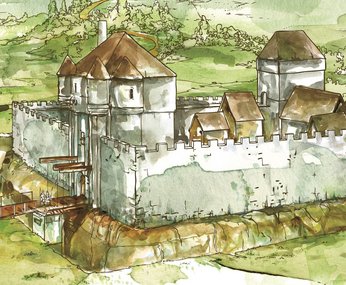
Locate an element on the screen. Image resolution: width=346 pixels, height=285 pixels. door is located at coordinates (79, 185).